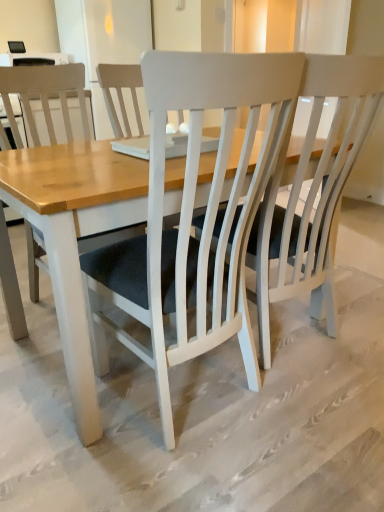
Locate an element on the screen. This screenshot has height=512, width=384. white matte chair at left is located at coordinates (44, 96).

Measure the distance between white matte chair at left and camera.

A distance of 1.79 meters exists between white matte chair at left and camera.

Image resolution: width=384 pixels, height=512 pixels. Describe the element at coordinates (44, 96) in the screenshot. I see `white matte chair at left` at that location.

Where is `white matte chair at left`? Image resolution: width=384 pixels, height=512 pixels. white matte chair at left is located at coordinates (44, 96).